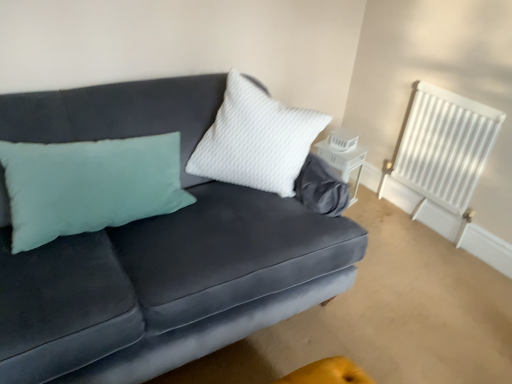
Locate an element on the screen. This screenshot has height=384, width=512. vacant area to the left of white painted metal radiator at upper right is located at coordinates (382, 213).